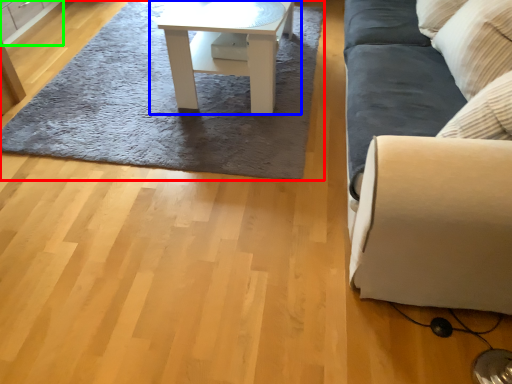
Question: Based on their relative distances, which object is farther from mat (highlighted by a red box)? Choose from table (highlighted by a blue box) and cabinetry (highlighted by a green box).

Choices:
 (A) table
 (B) cabinetry

Answer: (B)